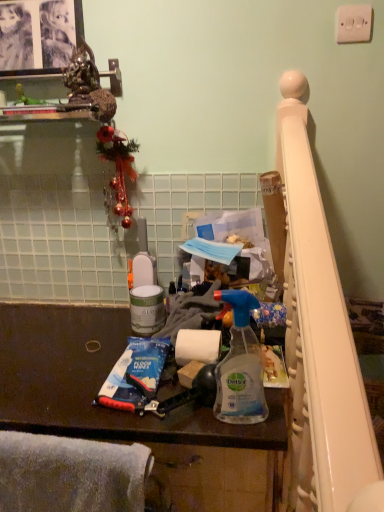
Question: Is dark brown laminate counter at center located outside white plastic light switch at upper right?

Choices:
 (A) yes
 (B) no

Answer: (A)

Question: From a real-world perspective, is dark brown laminate counter at center physically above white plastic light switch at upper right?

Choices:
 (A) yes
 (B) no

Answer: (B)

Question: Is white plastic light switch at upper right a part of dark brown laminate counter at center?

Choices:
 (A) yes
 (B) no

Answer: (B)

Question: Does dark brown laminate counter at center come behind white plastic light switch at upper right?

Choices:
 (A) yes
 (B) no

Answer: (B)

Question: Is dark brown laminate counter at center not close to white plastic light switch at upper right?

Choices:
 (A) no
 (B) yes

Answer: (B)

Question: Considering the positions of white plastic light switch at upper right and blue plastic toothpaste at lower center in the image, is white plastic light switch at upper right bigger or smaller than blue plastic toothpaste at lower center?

Choices:
 (A) big
 (B) small

Answer: (B)

Question: Does point (360, 17) appear closer or farther from the camera than point (115, 362)?

Choices:
 (A) closer
 (B) farther

Answer: (B)

Question: Is white plastic light switch at upper right wider or thinner than blue plastic toothpaste at lower center?

Choices:
 (A) wide
 (B) thin

Answer: (B)

Question: Considering their positions, is white plastic light switch at upper right located in front of or behind blue plastic toothpaste at lower center?

Choices:
 (A) front
 (B) behind

Answer: (B)

Question: Is white soft towel at lower left taller or shorter than transparent plastic spray bottle at center?

Choices:
 (A) short
 (B) tall

Answer: (A)

Question: From the image's perspective, is white soft towel at lower left positioned above or below transparent plastic spray bottle at center?

Choices:
 (A) below
 (B) above

Answer: (A)

Question: Is white soft towel at lower left wider or thinner than transparent plastic spray bottle at center?

Choices:
 (A) wide
 (B) thin

Answer: (A)

Question: Is white soft towel at lower left bigger or smaller than transparent plastic spray bottle at center?

Choices:
 (A) small
 (B) big

Answer: (B)

Question: From their relative heights in the image, would you say white soft towel at lower left is taller or shorter than blue plastic toothpaste at lower center?

Choices:
 (A) tall
 (B) short

Answer: (A)

Question: Choose the correct answer: Is white soft towel at lower left inside blue plastic toothpaste at lower center or outside it?

Choices:
 (A) outside
 (B) inside

Answer: (A)